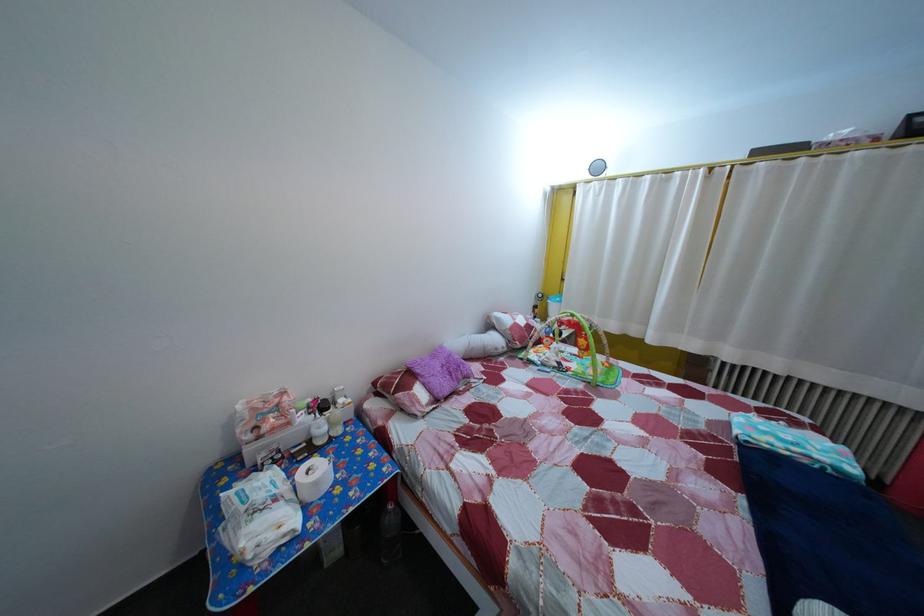
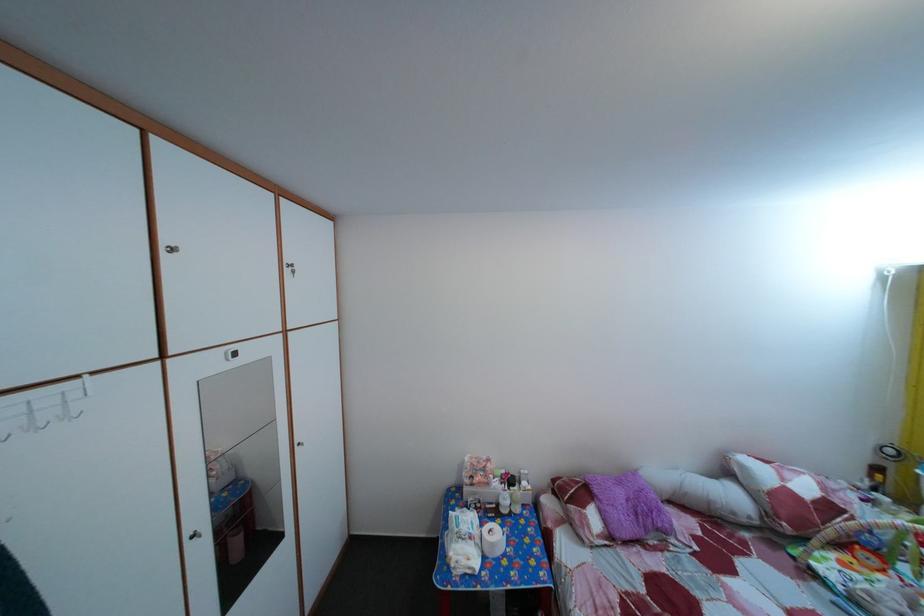
Question: Based on the continuous images, in which direction is the camera rotating? Reply with the corresponding letter.

Choices:
 (A) Left
 (B) Right
 (C) Up
 (D) Down

Answer: (A)